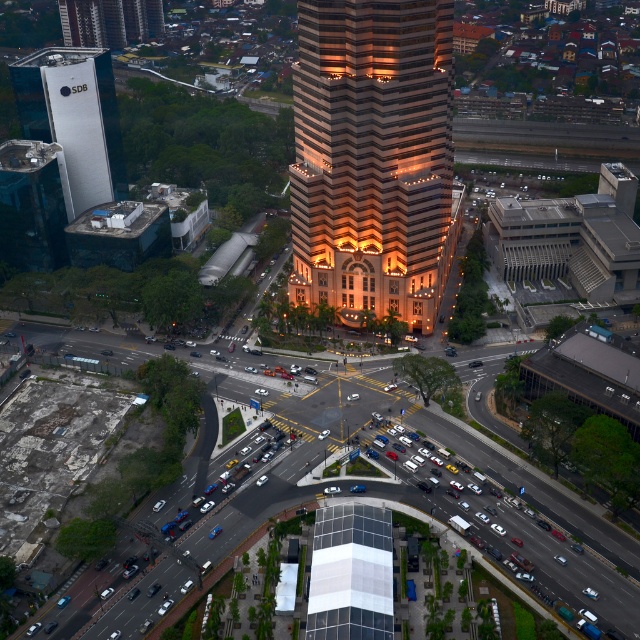
Based on the aerial view of the urban area, which object would likely occupy more horizontal space when viewed from above? The golden glass skyscraper at center or the matte glass skyscraper at upper left?

The golden glass skyscraper at center might be wider than matte glass skyscraper at upper left, so it likely occupies more horizontal space when viewed from above.

You are a drone operator who needs to fly a drone from the golden glass skyscraper at center to the matte glass skyscraper at upper left. Given that your drone has a maximum flight range of 300 feet, will it be able to reach the destination without recharging?

The golden glass skyscraper at center is 329.10 feet away from the matte glass skyscraper at upper left. Since the drone can only fly 300 feet before needing to recharge, it will not be able to reach the destination without recharging.

You are a drone operator trying to capture a photo of the golden glass skyscraper at center. Your drone is currently at coordinates point A which is at point A coordinates are at point A coordinates are at point A coordinates are at point A coordinates are at point A coordinates are at point A coordinates are at point A coordinates are at point A coordinates are at point A coordinates are at point A coordinates are at point A coordinates are at point A coordinates are at point A coordinates are at point A.

The golden glass skyscraper at center is located at point (372, 157). So the drone should move to that coordinate to capture the photo.